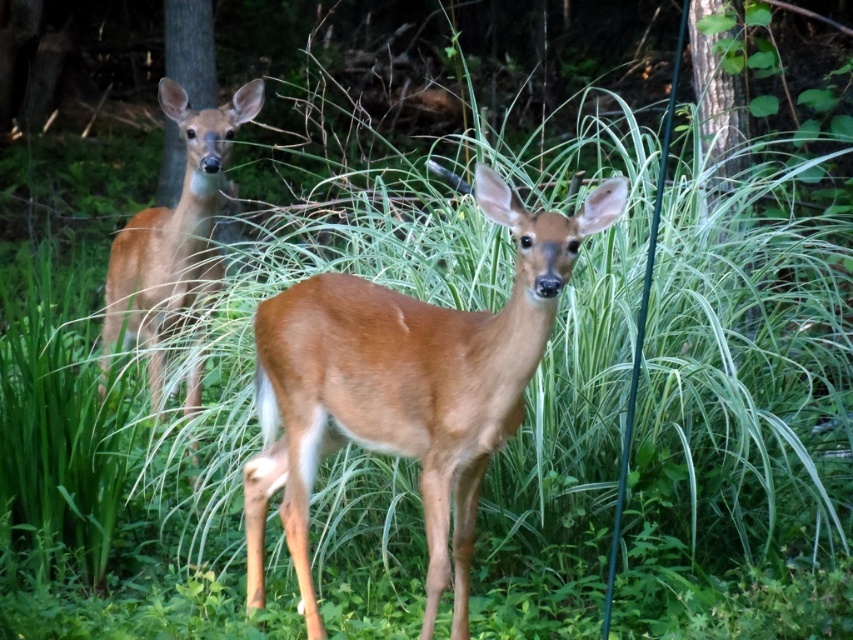
Between brown matte deer at center and brown matte/deer at center, which one appears on the right side from the viewer's perspective?

Positioned to the right is brown matte deer at center.

Between point (361, 412) and point (178, 296), which one is positioned behind?

The point (178, 296) is behind.

You are a GUI agent. You are given a task and a screenshot of the screen. Output one action in this format:
    pyautogui.click(x=<x>, y=<y>)
    Task: Click on the brown matte deer at center
    The height and width of the screenshot is (640, 853).
    Given the screenshot: What is the action you would take?
    pyautogui.click(x=405, y=387)